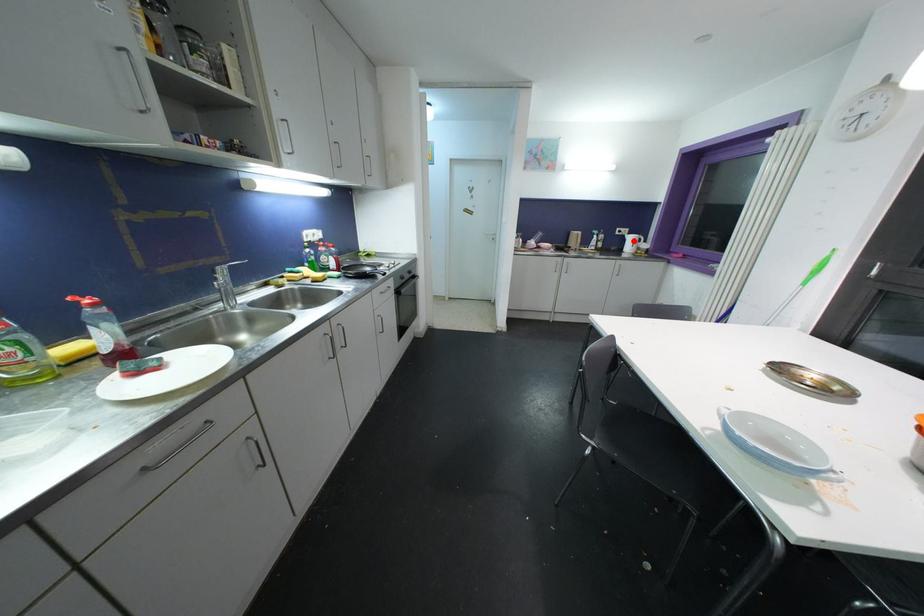
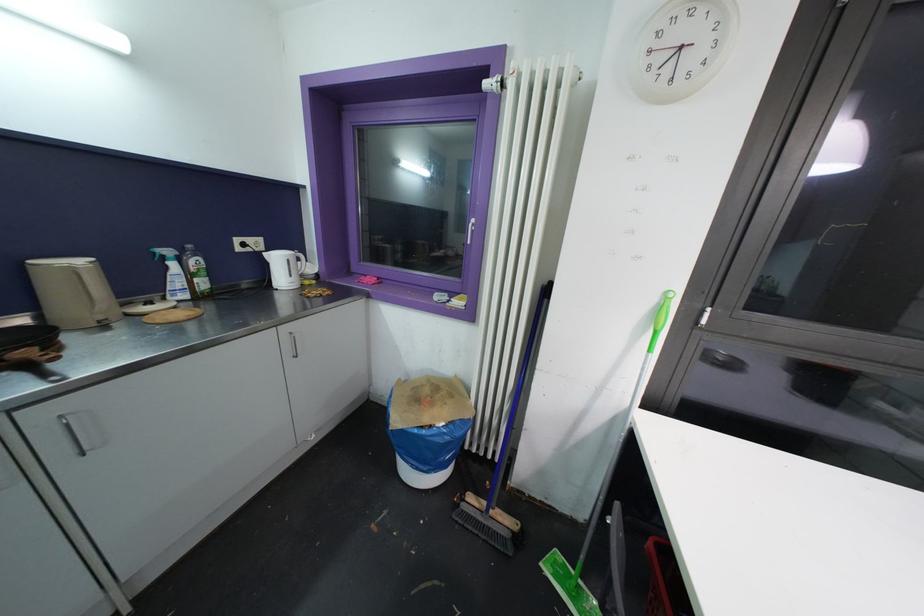
Question: A red point is marked in image1. In image2, is the corresponding 3D point closer to the camera or farther? Reply with the corresponding letter.

Choices:
 (A) The corresponding 3D point is closer.
 (B) The corresponding 3D point is farther.

Answer: (B)